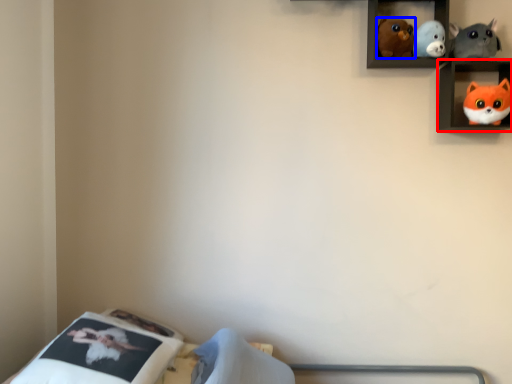
Question: Which object appears farthest to the camera in this image, shelf (highlighted by a red box) or toy (highlighted by a blue box)?

Choices:
 (A) shelf
 (B) toy

Answer: (B)